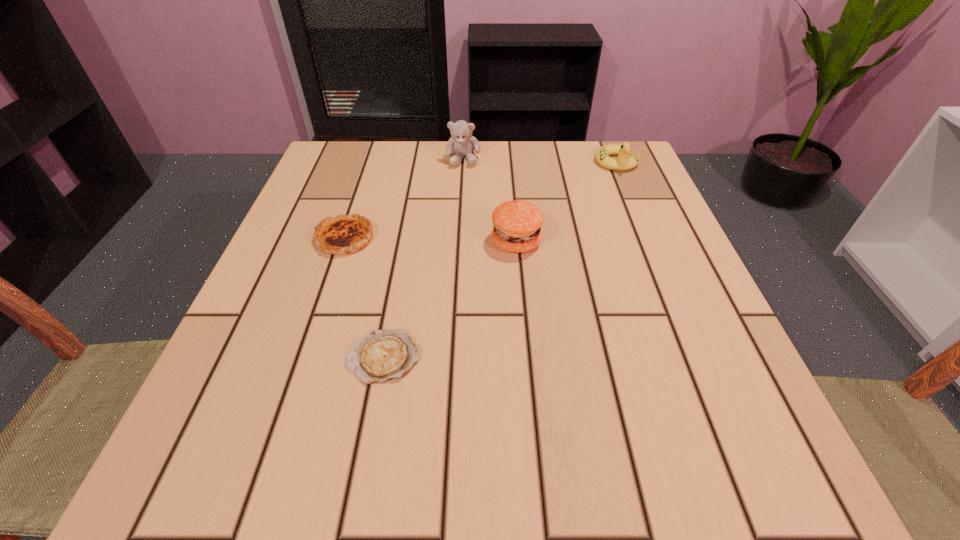
Where is `teddy bear`? Image resolution: width=960 pixels, height=540 pixels. teddy bear is located at coordinates (462, 143).

The image size is (960, 540). Find the location of `the third object from right to left`. the third object from right to left is located at coordinates (462, 143).

Find the location of `patty`. patty is located at coordinates (517, 224).

I want to click on the rightmost object, so click(628, 158).

Image resolution: width=960 pixels, height=540 pixels. In order to click on the leftmost object in this screenshot , I will do [x=345, y=234].

Image resolution: width=960 pixels, height=540 pixels. What are the coordinates of `the taller quiche` in the screenshot? It's located at (345, 234).

You are a GUI agent. You are given a task and a screenshot of the screen. Output one action in this format:
    pyautogui.click(x=<x>, y=<y>)
    Task: Click on the nearest object
    
    Given the screenshot: What is the action you would take?
    (x=383, y=355)

Image resolution: width=960 pixels, height=540 pixels. What are the coordinates of `the shortest object` in the screenshot? It's located at (383, 355).

You are a GUI agent. You are given a task and a screenshot of the screen. Output one action in this format:
    pyautogui.click(x=<x>, y=<y>)
    Task: Click on the free space located 0.280m on the face of the third object from right to left
    
    Given the screenshot: What is the action you would take?
    pyautogui.click(x=459, y=251)

I want to click on vacant space located 0.080m on the back of the patty, so click(513, 202).